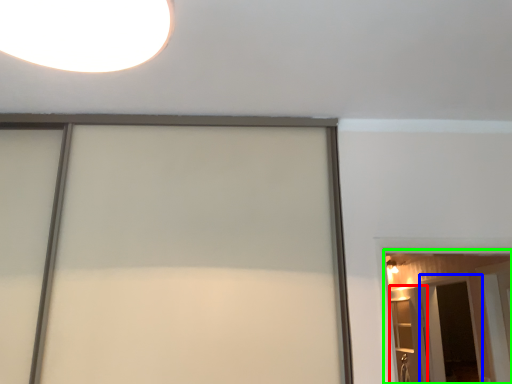
Question: Estimate the real-world distances between objects in this image. Which object is farther from elevator (highlighted by a red box), screen door (highlighted by a blue box) or barn door (highlighted by a green box)?

Choices:
 (A) screen door
 (B) barn door

Answer: (B)